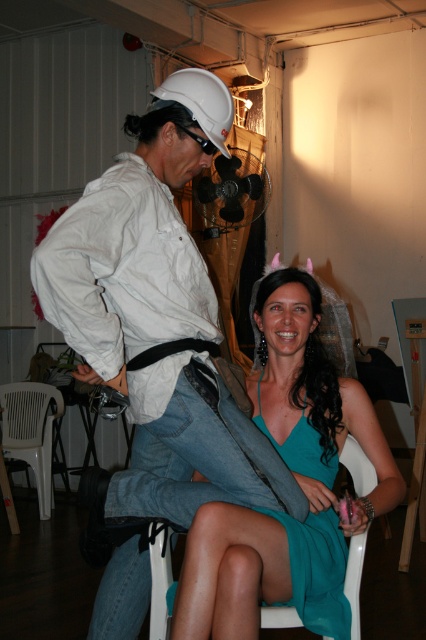
You are standing at point (94, 211) and want to walk to the seated person in the teal dress. The minimum distance you need to cover is 1.52 meters. Is there enough space to walk directly to them without obstacles?

The distance between you and the seated person in the teal dress is 1.52 meters. Since there are no mentioned obstacles in the scene description, you can walk directly to them.

Looking at this image, you are trying to decide whether to place a decorative item on either the white matte hard hat at upper left or the white plastic folding chair at lower left. Which object has a wider base to support the item?

The white matte hard hat at upper left might be wider than the white plastic folding chair at lower left, so it could provide a wider base for the decorative item.